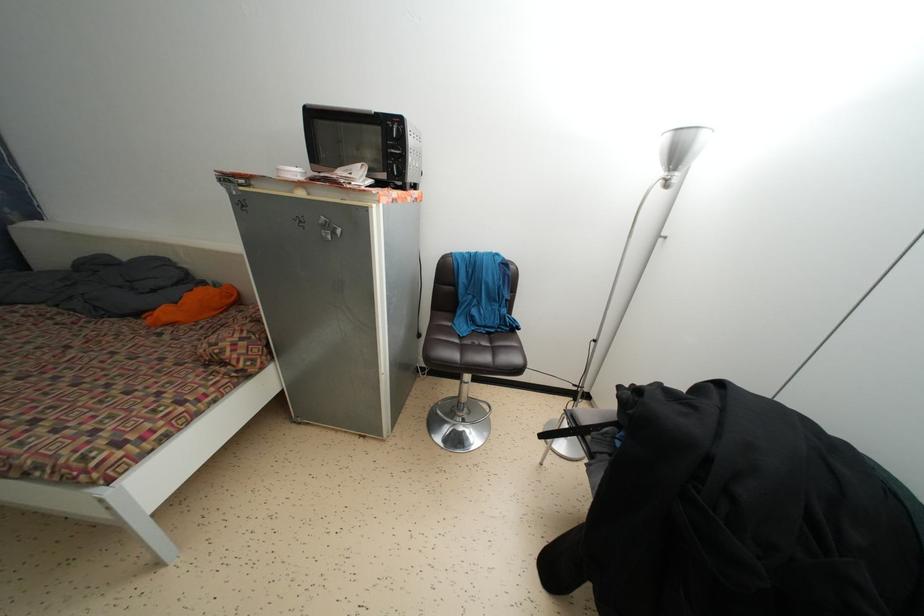
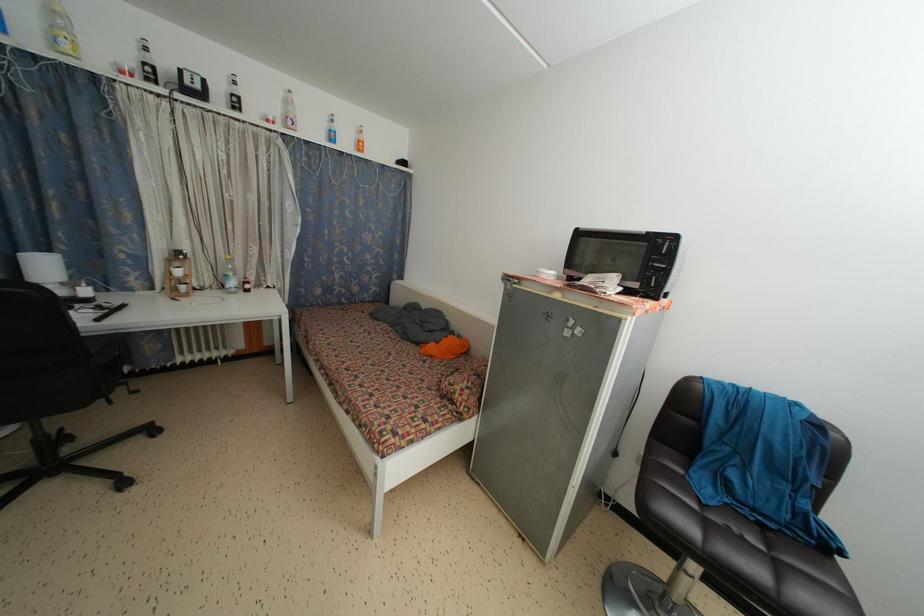
The point at (492,339) is marked in the first image. Where is the corresponding point in the second image?

(767, 532)